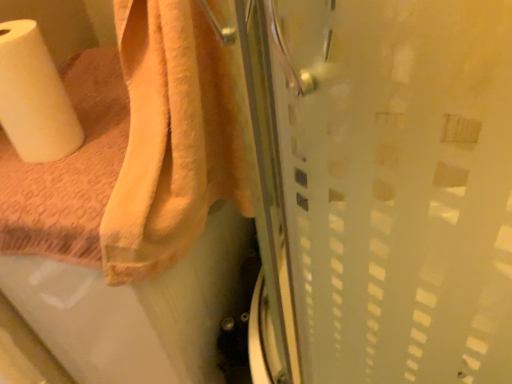
Where is `free space to the back side of white matte paper towel at left`? The width and height of the screenshot is (512, 384). free space to the back side of white matte paper towel at left is located at coordinates (95, 98).